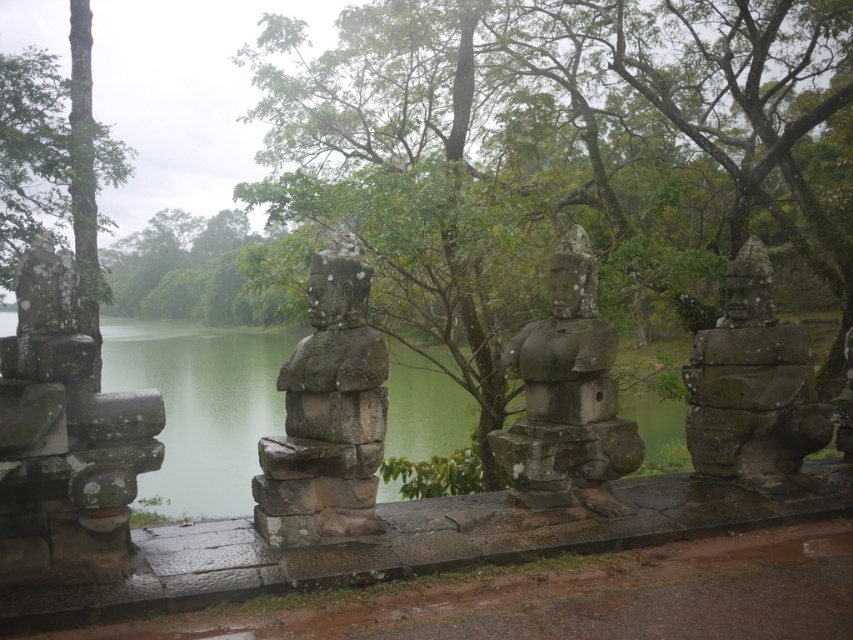
Does green leafy tree at center appear on the left side of rusty stone statue at left?

In fact, green leafy tree at center is to the right of rusty stone statue at left.

Is green leafy tree at center smaller than rusty stone statue at left?

Yes.

Who is more distant from viewer, (676, 0) or (134, 465)?

Point (676, 0)

Where is `green leafy tree at center`? green leafy tree at center is located at coordinates 550,148.

Does rusty stone statue at left lie behind green rough bark tree at upper left?

No, it is not.

Locate an element on the screen. The width and height of the screenshot is (853, 640). rusty stone statue at left is located at coordinates (64, 436).

Measure the distance between stone statue at center and green rough bark tree at upper left.

The distance of stone statue at center from green rough bark tree at upper left is 4.36 meters.

Between stone statue at center and green rough bark tree at upper left, which one has more height?

green rough bark tree at upper left is taller.

Where is `stone statue at center`? This screenshot has height=640, width=853. stone statue at center is located at coordinates (328, 412).